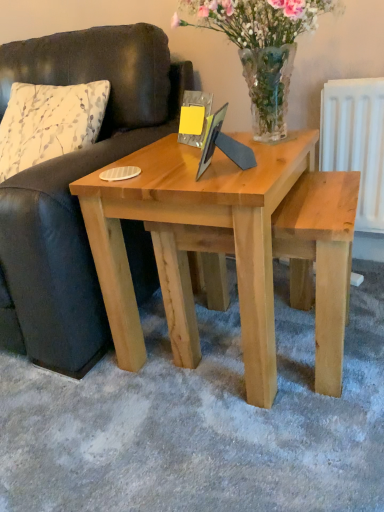
Question: From the image's perspective, does leather couch at left appear higher than natural wood coffee table at center?

Choices:
 (A) yes
 (B) no

Answer: (A)

Question: Considering the relative positions of leather couch at left and natural wood coffee table at center in the image provided, is leather couch at left in front of natural wood coffee table at center?

Choices:
 (A) no
 (B) yes

Answer: (B)

Question: Is leather couch at left turned away from natural wood coffee table at center?

Choices:
 (A) no
 (B) yes

Answer: (A)

Question: Considering the relative sizes of leather couch at left and natural wood coffee table at center in the image provided, is leather couch at left smaller than natural wood coffee table at center?

Choices:
 (A) yes
 (B) no

Answer: (B)

Question: Is leather couch at left taller than natural wood coffee table at center?

Choices:
 (A) no
 (B) yes

Answer: (B)

Question: Is leather couch at left to the right of natural wood coffee table at center from the viewer's perspective?

Choices:
 (A) yes
 (B) no

Answer: (B)

Question: Is clear glass vase at center inside natural wood coffee table at center?

Choices:
 (A) no
 (B) yes

Answer: (A)

Question: Is natural wood coffee table at center facing towards clear glass vase at center?

Choices:
 (A) yes
 (B) no

Answer: (B)

Question: Does natural wood coffee table at center have a larger size compared to clear glass vase at center?

Choices:
 (A) yes
 (B) no

Answer: (A)

Question: Considering the relative positions of natural wood coffee table at center and clear glass vase at center in the image provided, is natural wood coffee table at center to the left of clear glass vase at center from the viewer's perspective?

Choices:
 (A) yes
 (B) no

Answer: (A)

Question: From the image's perspective, would you say natural wood coffee table at center is positioned over clear glass vase at center?

Choices:
 (A) no
 (B) yes

Answer: (A)

Question: Is natural wood coffee table at center smaller than clear glass vase at center?

Choices:
 (A) yes
 (B) no

Answer: (B)

Question: Can you confirm if leather couch at left is smaller than white printed fabric pillow at left?

Choices:
 (A) no
 (B) yes

Answer: (A)